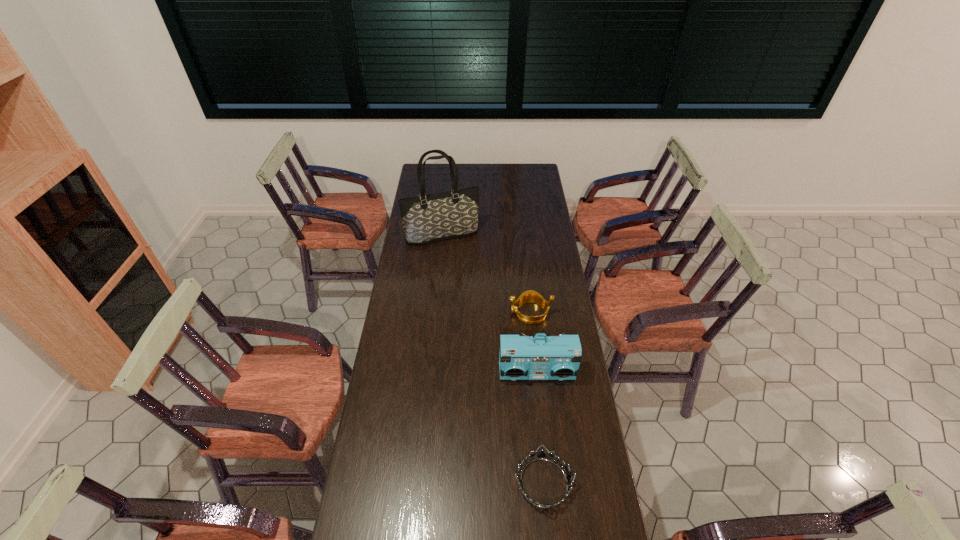
Image resolution: width=960 pixels, height=540 pixels. In order to click on free space between the second tallest object and the farthest object in this screenshot , I will do `click(490, 305)`.

Identify which object is located as the third nearest to the tote bag. Please provide its 2D coordinates. Your answer should be formatted as a tuple, i.e. [(x, y)], where the tuple contains the x and y coordinates of a point satisfying the conditions above.

[(541, 455)]

Identify which object is the second closest to the third farthest object. Please provide its 2D coordinates. Your answer should be formatted as a tuple, i.e. [(x, y)], where the tuple contains the x and y coordinates of a point satisfying the conditions above.

[(541, 455)]